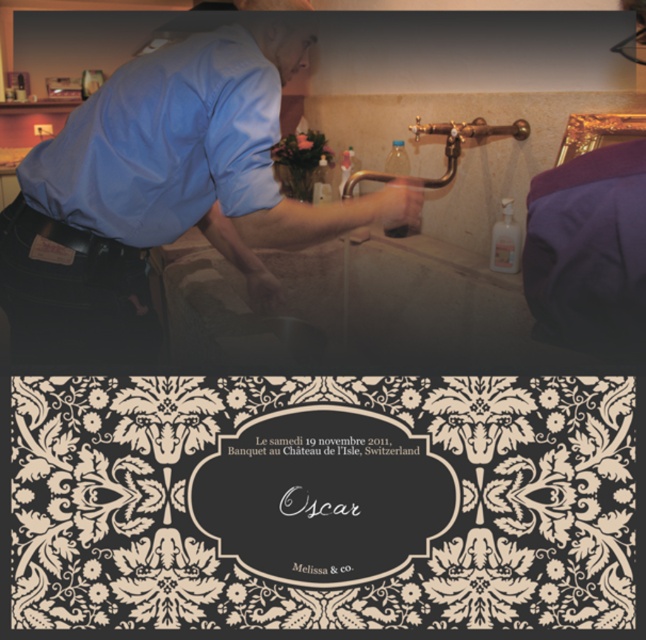
You are standing in the upper section of the image and notice the blue smooth shirt at center. Can you determine its exact position using the coordinate system provided?

The blue smooth shirt at center is located at point (162, 189) according to the coordinate system provided.

You are standing in a room and see the blue smooth shirt at center and the matte blue shirt at upper left. Which shirt is located lower in the image?

The blue smooth shirt at center is located lower than the matte blue shirt at upper left.